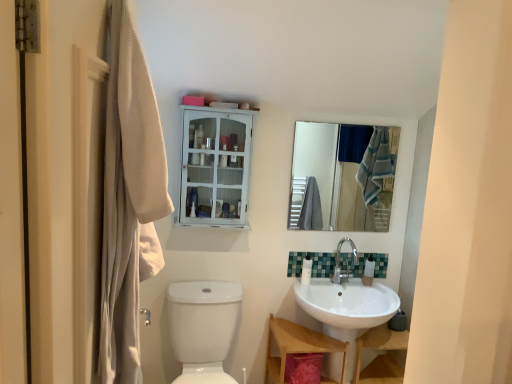
Question: Is silver metallic faucet at center at the left side of white glossy sink at lower right?

Choices:
 (A) no
 (B) yes

Answer: (A)

Question: Is silver metallic faucet at center thinner than white glossy sink at lower right?

Choices:
 (A) yes
 (B) no

Answer: (A)

Question: Is silver metallic faucet at center positioned with its back to white glossy sink at lower right?

Choices:
 (A) yes
 (B) no

Answer: (B)

Question: Does silver metallic faucet at center have a greater width compared to white glossy sink at lower right?

Choices:
 (A) yes
 (B) no

Answer: (B)

Question: Is silver metallic faucet at center positioned beyond the bounds of white glossy sink at lower right?

Choices:
 (A) no
 (B) yes

Answer: (B)

Question: In the image, is white glossy toilet bowl at lower left on the left side or the right side of white wooden cabinet at upper center?

Choices:
 (A) right
 (B) left

Answer: (B)

Question: In terms of size, does white glossy toilet bowl at lower left appear bigger or smaller than white wooden cabinet at upper center?

Choices:
 (A) small
 (B) big

Answer: (B)

Question: From their relative heights in the image, would you say white glossy toilet bowl at lower left is taller or shorter than white wooden cabinet at upper center?

Choices:
 (A) tall
 (B) short

Answer: (A)

Question: In the image, is white glossy toilet bowl at lower left positioned in front of or behind white wooden cabinet at upper center?

Choices:
 (A) behind
 (B) front

Answer: (B)

Question: Is point (381, 268) positioned closer to the camera than point (387, 347)?

Choices:
 (A) farther
 (B) closer

Answer: (A)

Question: Looking at their shapes, would you say green mosaic tile at center is wider or thinner than wooden vanity at lower center?

Choices:
 (A) wide
 (B) thin

Answer: (B)

Question: From their relative heights in the image, would you say green mosaic tile at center is taller or shorter than wooden vanity at lower center?

Choices:
 (A) tall
 (B) short

Answer: (B)

Question: Relative to wooden vanity at lower center, is green mosaic tile at center in front or behind?

Choices:
 (A) front
 (B) behind

Answer: (B)

Question: Is point (367, 259) positioned closer to the camera than point (222, 314)?

Choices:
 (A) closer
 (B) farther

Answer: (B)

Question: From their relative heights in the image, would you say white glossy bottle at right, which ranks as the 2th toiletry in left-to-right order, is taller or shorter than white glossy toilet bowl at lower left?

Choices:
 (A) short
 (B) tall

Answer: (A)